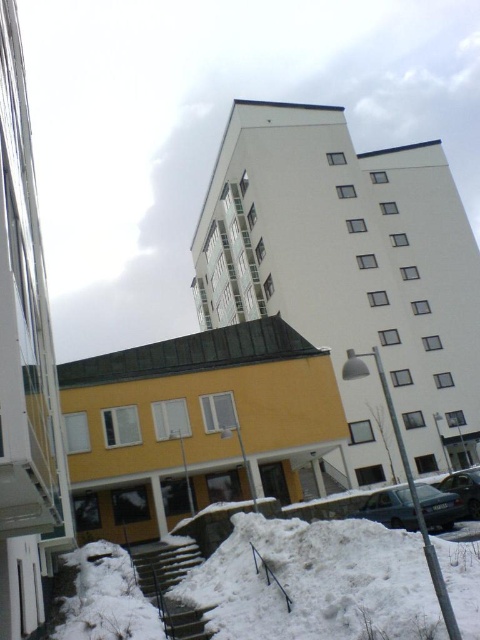
Is teal metallic car at lower right bigger than metallic silver car at center?

Incorrect, teal metallic car at lower right is not larger than metallic silver car at center.

Locate an element on the screen. Image resolution: width=480 pixels, height=640 pixels. teal metallic car at lower right is located at coordinates (391, 508).

The height and width of the screenshot is (640, 480). What do you see at coordinates (169, 584) in the screenshot?
I see `snow-covered concrete stairs at lower left` at bounding box center [169, 584].

Who is lower down, snow-covered concrete stairs at lower left or metallic silver car at center?

snow-covered concrete stairs at lower left

Is point (137, 566) closer to viewer compared to point (478, 476)?

That is True.

Where is `snow-covered concrete stairs at lower left`? The image size is (480, 640). snow-covered concrete stairs at lower left is located at coordinates (169, 584).

Can you confirm if yellow matte building at lower left is bigger than metallic silver car at center?

Yes, yellow matte building at lower left is bigger than metallic silver car at center.

Locate an element on the screen. The image size is (480, 640). yellow matte building at lower left is located at coordinates (197, 426).

The height and width of the screenshot is (640, 480). I want to click on yellow matte building at lower left, so click(x=197, y=426).